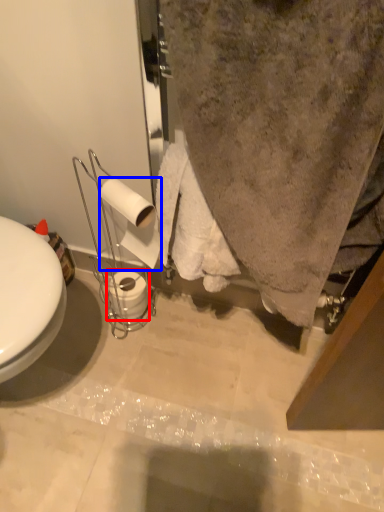
Question: Among these objects, which one is farthest to the camera, toilet paper (highlighted by a red box) or toilet paper (highlighted by a blue box)?

Choices:
 (A) toilet paper
 (B) toilet paper

Answer: (A)